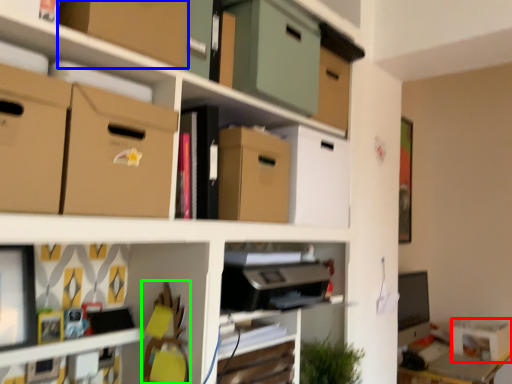
Question: Based on their relative distances, which object is nearer to storage box (highlighted by a red box)? Choose from cardboard box (highlighted by a blue box) and swivel chair (highlighted by a green box).

Choices:
 (A) cardboard box
 (B) swivel chair

Answer: (B)